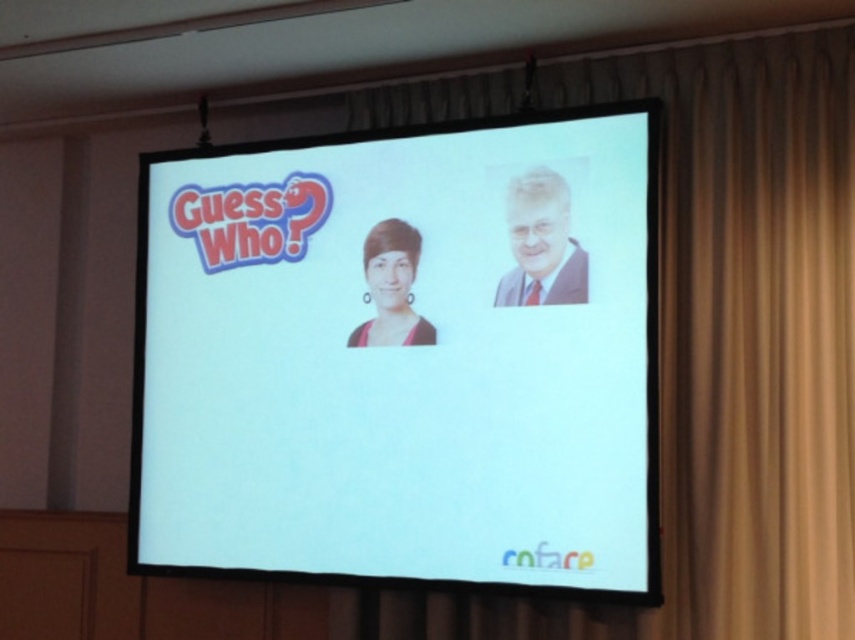
You are setting up a projector for a presentation. The projector can only project onto surfaces wider than 2 meters. You see the white glossy screen at center and the beige fabric curtain at upper center. Which surface should you choose to ensure the projection fits properly?

The white glossy screen at center is wider than the beige fabric curtain at upper center, so you should choose the white glossy screen at center for the projection to ensure it fits properly.

You are setting up a presentation and need to ensure that the white glossy screen at center and the matte gray suit at upper right are both visible to the audience. Given their sizes, which object should you prioritize positioning closer to the front to ensure clarity?

The white glossy screen at center is bigger than the matte gray suit at upper right, so you should prioritize positioning the white glossy screen at center closer to the front to ensure its clarity since it is larger and likely contains the main content.

Consider the image. You are sitting in the front row of an event hall and notice the white glossy screen at center. If you want to take a photo of the screen, which direction should you face to ensure the screen is centered in your camera view?

You should face directly towards the white glossy screen at center to ensure it is centered in your camera view since it is located at the central point of the image.